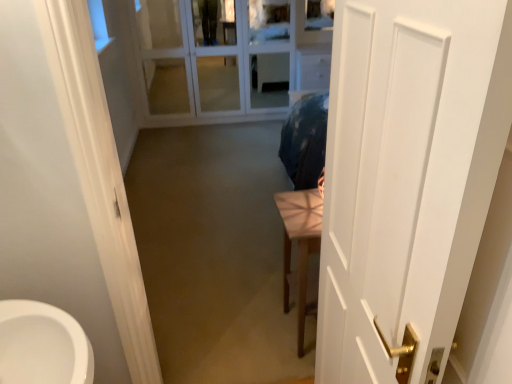
Question: Considering the positions of point (210, 6) and point (302, 269), is point (210, 6) closer or farther from the camera than point (302, 269)?

Choices:
 (A) closer
 (B) farther

Answer: (B)

Question: From a real-world perspective, is white glass door at upper center positioned above or below light brown wooden table at center?

Choices:
 (A) below
 (B) above

Answer: (B)

Question: Which is nearer to the white glass door at upper center?

Choices:
 (A) white matte door at right
 (B) light brown wooden table at center

Answer: (B)

Question: Which object is the closest to the white glass door at upper center?

Choices:
 (A) white matte door at right
 (B) light brown wooden table at center

Answer: (B)